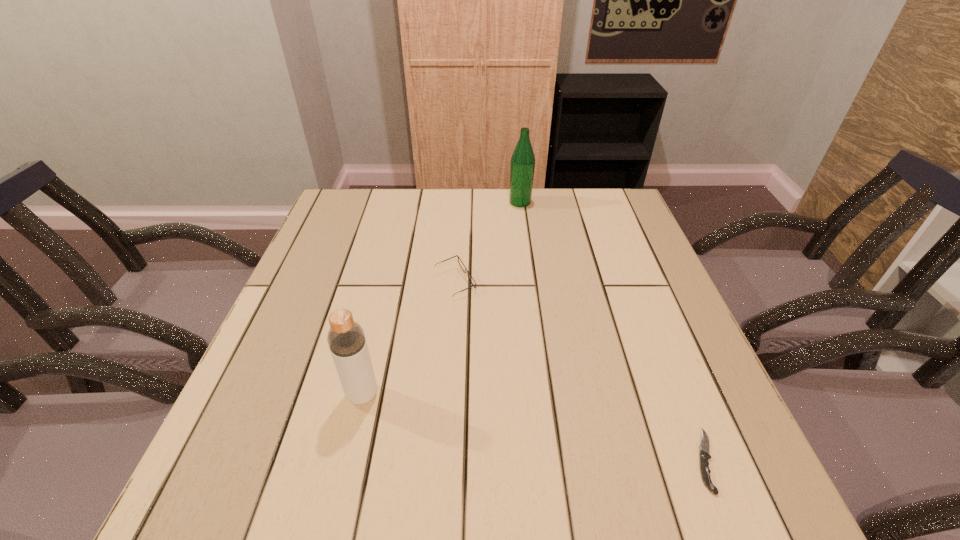
Locate an element on the screen. The width and height of the screenshot is (960, 540). vacant space at the near right corner of the desktop is located at coordinates (715, 468).

What are the coordinates of `blank region between the right bottle and the second shortest object` in the screenshot? It's located at (488, 242).

The height and width of the screenshot is (540, 960). In order to click on empty space between the shortest object and the third object from right to left in this screenshot , I will do `click(580, 372)`.

Identify the location of vacant point located between the third nearest object and the farther bottle. This screenshot has width=960, height=540. (488, 242).

This screenshot has width=960, height=540. What are the coordinates of `free space between the nearest object and the left bottle` in the screenshot? It's located at (534, 428).

The height and width of the screenshot is (540, 960). Identify the location of free spot between the second nearest object and the shortest object. (534, 428).

This screenshot has height=540, width=960. In order to click on free spot between the third farthest object and the shortest object in this screenshot , I will do `click(534, 428)`.

Find the location of a particular element. blank region between the leftmost object and the third object from right to left is located at coordinates (409, 339).

Locate an element on the screen. The height and width of the screenshot is (540, 960). vacant space that's between the third tallest object and the second object from right to left is located at coordinates (488, 242).

Where is `free space between the pocketknife and the left bottle`? free space between the pocketknife and the left bottle is located at coordinates (534, 428).